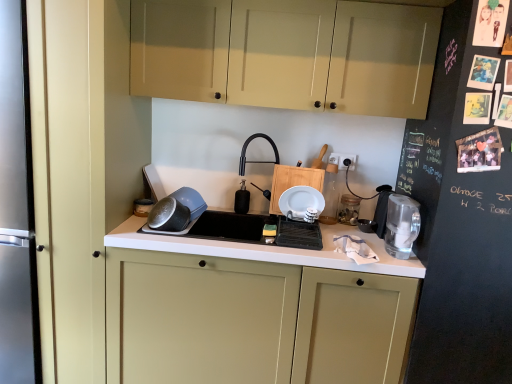
Question: Can you confirm if matte black container at left, the fourth appliance when ordered from right to left, is thinner than white plastic electric outlet at upper right?

Choices:
 (A) yes
 (B) no

Answer: (B)

Question: Is matte black container at left, marked as the first appliance in a left-to-right arrangement, not close to white plastic electric outlet at upper right?

Choices:
 (A) yes
 (B) no

Answer: (B)

Question: From a real-world perspective, is matte black container at left, the fourth appliance when ordered from right to left, over white plastic electric outlet at upper right?

Choices:
 (A) yes
 (B) no

Answer: (B)

Question: Does matte black container at left, marked as the first appliance in a left-to-right arrangement, have a greater width compared to white plastic electric outlet at upper right?

Choices:
 (A) no
 (B) yes

Answer: (B)

Question: Does matte black container at left, marked as the first appliance in a left-to-right arrangement, have a greater height compared to white plastic electric outlet at upper right?

Choices:
 (A) yes
 (B) no

Answer: (B)

Question: Considering the relative sizes of matte black container at left, marked as the first appliance in a left-to-right arrangement, and white plastic electric outlet at upper right in the image provided, is matte black container at left, marked as the first appliance in a left-to-right arrangement, bigger than white plastic electric outlet at upper right?

Choices:
 (A) yes
 (B) no

Answer: (A)

Question: Does matte plastic bowl at center have a greater width compared to matte cream cabinets at upper center, placed as the 2th cabinetry when sorted from bottom to top?

Choices:
 (A) yes
 (B) no

Answer: (B)

Question: Could you tell me if matte plastic bowl at center is facing matte cream cabinets at upper center, placed as the 2th cabinetry when sorted from bottom to top?

Choices:
 (A) yes
 (B) no

Answer: (B)

Question: Is matte plastic bowl at center outside of matte cream cabinets at upper center, placed as the 2th cabinetry when sorted from bottom to top?

Choices:
 (A) no
 (B) yes

Answer: (B)

Question: From a real-world perspective, does matte plastic bowl at center stand above matte cream cabinets at upper center, the 1th cabinetry when ordered from top to bottom?

Choices:
 (A) yes
 (B) no

Answer: (B)

Question: Is matte plastic bowl at center thinner than matte cream cabinets at upper center, placed as the 2th cabinetry when sorted from bottom to top?

Choices:
 (A) yes
 (B) no

Answer: (A)

Question: Considering the relative sizes of matte plastic bowl at center and matte cream cabinets at upper center, placed as the 2th cabinetry when sorted from bottom to top, in the image provided, is matte plastic bowl at center taller than matte cream cabinets at upper center, placed as the 2th cabinetry when sorted from bottom to top,?

Choices:
 (A) yes
 (B) no

Answer: (B)

Question: Is clear glass water filter at right inside black matte soap dispenser at center, which is the 3th appliance from right to left?

Choices:
 (A) yes
 (B) no

Answer: (B)